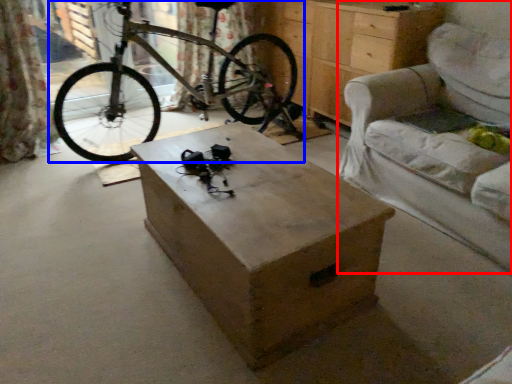
Question: Which point is further to the camera, armchair (highlighted by a red box) or bicycle (highlighted by a blue box)?

Choices:
 (A) armchair
 (B) bicycle

Answer: (B)